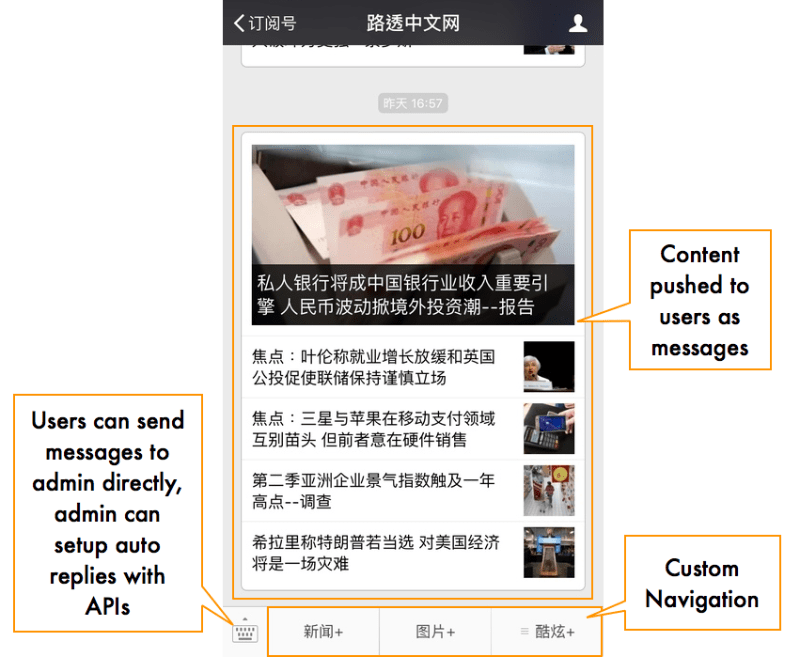
You are a GUI agent. You are given a task and a screenshot of the screen. Output one action in this format:
    pyautogui.click(x=<x>, y=<y>)
    Task: Click on the thumbnail pictures
    
    Given the screenshot: What is the action you would take?
    pyautogui.click(x=550, y=541), pyautogui.click(x=546, y=481), pyautogui.click(x=546, y=412), pyautogui.click(x=545, y=361)